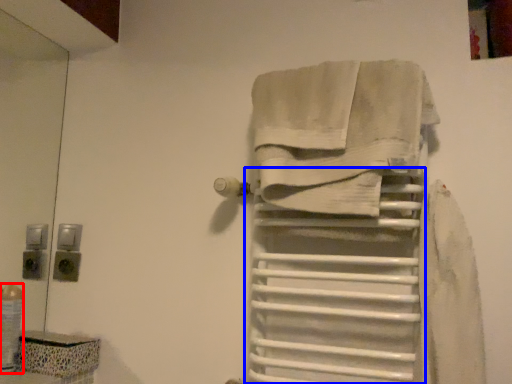
Question: Which of the following is the farthest to the observer, toiletry (highlighted by a red box) or shelf (highlighted by a blue box)?

Choices:
 (A) toiletry
 (B) shelf

Answer: (A)